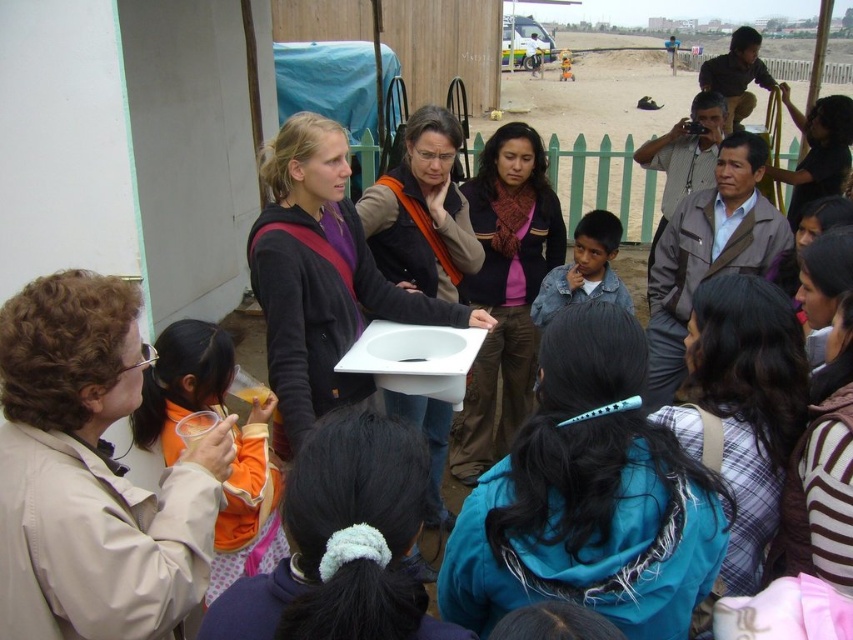
Based on the photo, you are standing at point A located at coordinates point A at (508, 531). You need to walk to point B, which is 1.56 meters away from point A. Considering the scene described, what object or structure might be in your path that you need to navigate around?

The green picket fence running horizontally across the middle of the scene might be in your path, so you need to navigate around it.

You are a photographer trying to capture the teal fabric hair clip at center in your shot. Given the coordinates provided, where should you position your camera relative to the scene?

The teal fabric hair clip at center is located at point coordinates, so position your camera to focus on that specific coordinate to capture it.

You are organizing a photo shoot and need to arrange two models wearing the plaid fabric shirt at center and orange fabric shirt at left. Based on their sizes, which model should stand closer to the camera to ensure both appear roughly the same size in the photo?

The plaid fabric shirt at center, which is smaller in size, should stand closer to the camera. This adjustment will help balance their apparent sizes in the photo since the smaller shirt needs to be nearer to appear larger, matching the size of the orange fabric shirt at left.